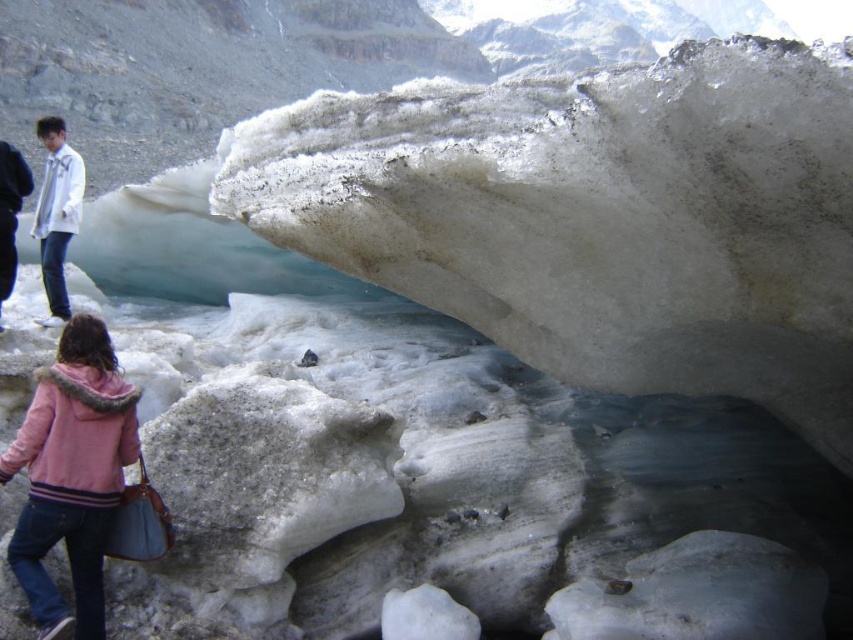
Question: Which point appears closest to the camera in this image?

Choices:
 (A) (668, 346)
 (B) (73, 195)
 (C) (65, 332)

Answer: (C)

Question: Does translucent ice at center have a greater width compared to white matte jacket at upper left?

Choices:
 (A) no
 (B) yes

Answer: (A)

Question: Which of the following is the closest to the observer?

Choices:
 (A) pink fleece jacket at lower left
 (B) white matte jacket at upper left

Answer: (A)

Question: Is translucent ice at center to the right of white matte jacket at upper left from the viewer's perspective?

Choices:
 (A) no
 (B) yes

Answer: (B)

Question: Can you confirm if translucent ice at center is positioned above pink fleece jacket at lower left?

Choices:
 (A) no
 (B) yes

Answer: (B)

Question: Which point is farther to the camera?

Choices:
 (A) (849, 288)
 (B) (67, 228)

Answer: (B)